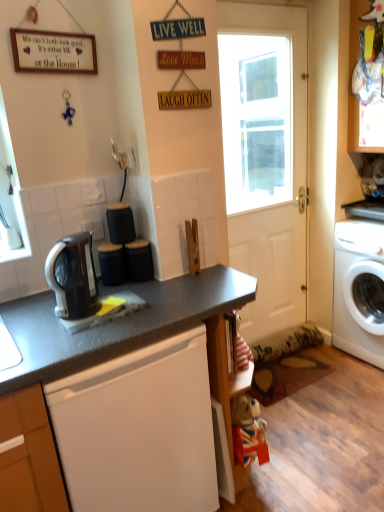
Where is `free point to the right of black glossy coffee maker at left`? The image size is (384, 512). free point to the right of black glossy coffee maker at left is located at coordinates (141, 306).